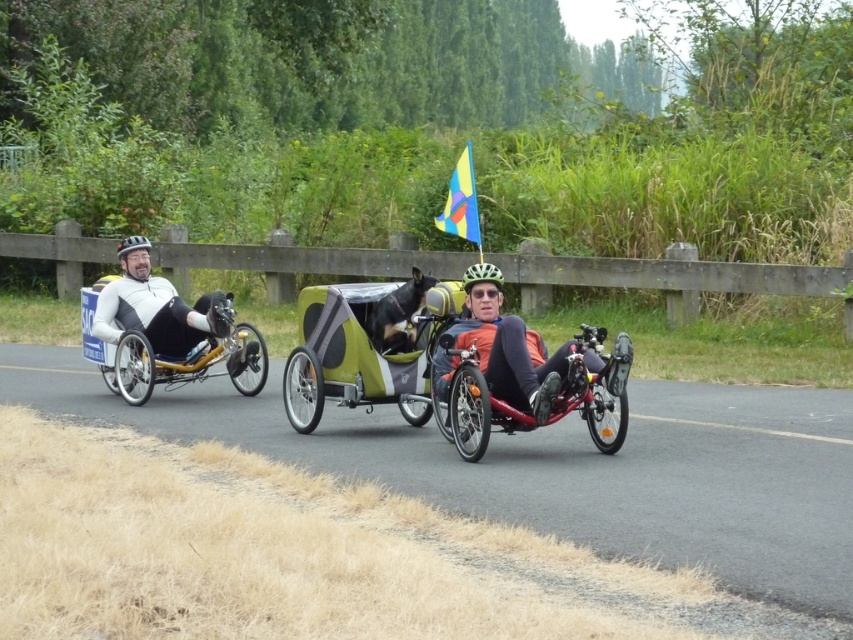
From the picture: You are a photographer standing on the side of the road. You want to take a photo of both the green textured cargo bike at center and the red recumbent trike on the right. The minimum distance between the two bikes for a clear shot is 10 meters. Can you capture both in the same frame?

The two bikes are 10.64 meters apart, which exceeds the minimum required distance of 10 meters. Therefore, you can capture both the green textured cargo bike at center and the red recumbent trike on the right in the same frame.

You are a delivery person who needs to place a package on the green textured cargo bike at center. The package must be placed at the coordinates point (x=352, y=355). Can you confirm if this point is on the green textured cargo bike at center?

Yes, the point (x=352, y=355) is on the green textured cargo bike at center as described.